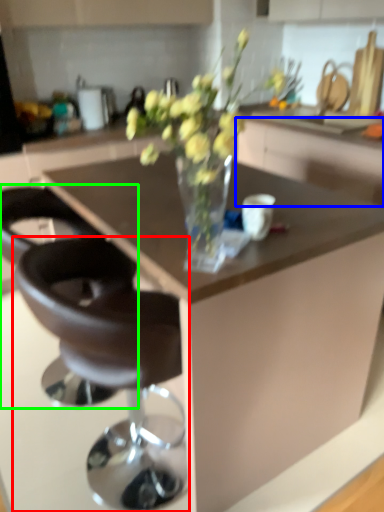
Question: Which is nearer to the chair (highlighted by a red box)? cabinetry (highlighted by a blue box) or chair (highlighted by a green box).

Choices:
 (A) cabinetry
 (B) chair

Answer: (B)